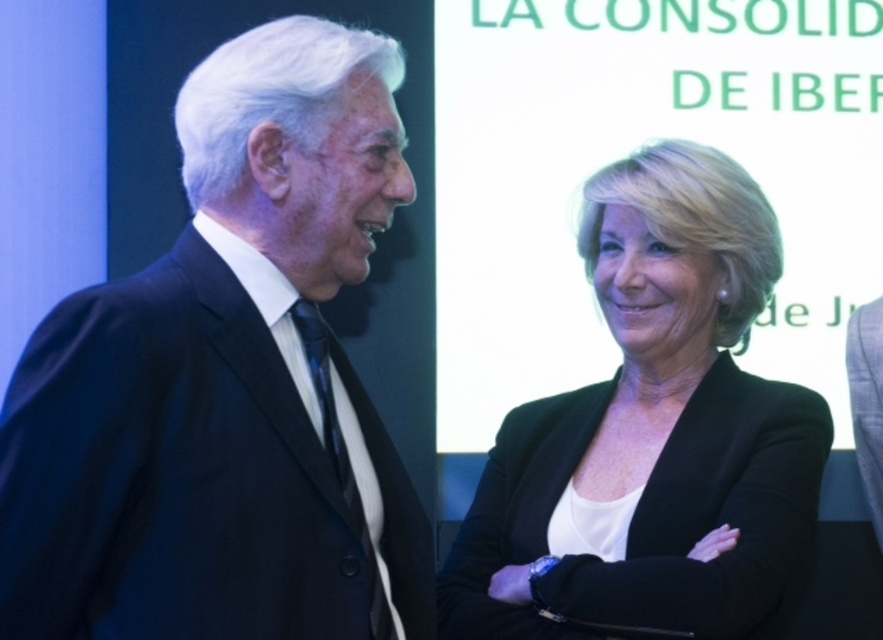
Does black matte suit at center have a smaller size compared to light blue wool suit at right?

Actually, black matte suit at center might be larger than light blue wool suit at right.

Does point (283, 276) come behind point (857, 321)?

No, (283, 276) is in front of (857, 321).

In order to click on black matte suit at center in this screenshot , I will do pyautogui.click(x=227, y=381).

From the picture: Which is below, black matte suit at center or black matte blazer at center?

black matte blazer at center is below.

Is black matte suit at center closer to the viewer compared to black matte blazer at center?

That is True.

Does point (68, 445) come farther from viewer compared to point (662, 268)?

No, (68, 445) is in front of (662, 268).

I want to click on black matte suit at center, so [x=227, y=381].

Is black matte blazer at center to the left of light blue wool suit at right from the viewer's perspective?

Correct, you'll find black matte blazer at center to the left of light blue wool suit at right.

Between black matte blazer at center and light blue wool suit at right, which one is positioned lower?

light blue wool suit at right is lower down.

The width and height of the screenshot is (883, 640). In order to click on black matte blazer at center in this screenshot , I will do click(651, 433).